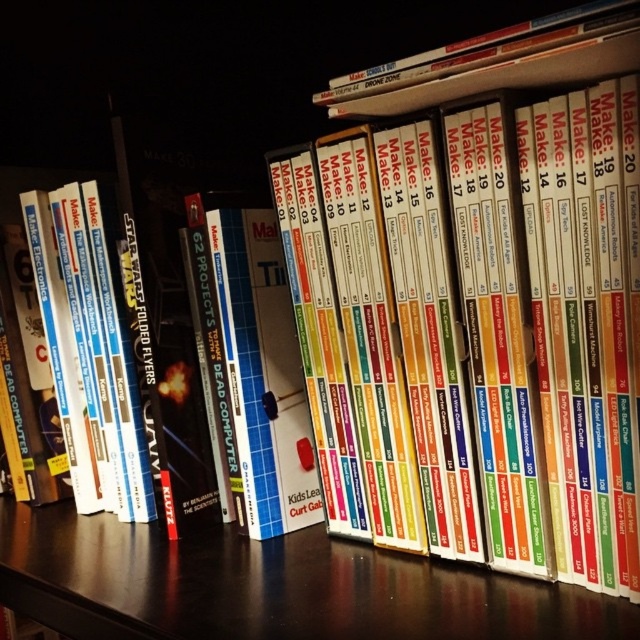
You are standing in front of a bookshelf and see the black wood table at center and the hardcover book at upper center. Which object is closer to you?

The black wood table at center is closer to you than the hardcover book at upper center because it is further to the viewer.

You are organizing a DIY workshop and need to place a tool kit on the black wood table at center. However, there is a hardcover book at upper center in the way. Can you place the tool kit on the table without moving the book?

The black wood table at center is located below the hardcover book at upper center, so you can place the tool kit on the table without moving the book as they are at different heights.

You are organizing a workshop and need to place a decorative item on the black wood table at center. The item requires a space wider than the hardcover book at upper center. Can the table accommodate it?

The black wood table at center has a width larger than the hardcover book at upper center, so yes, the table can accommodate the decorative item requiring more space than the hardcover book at upper center.